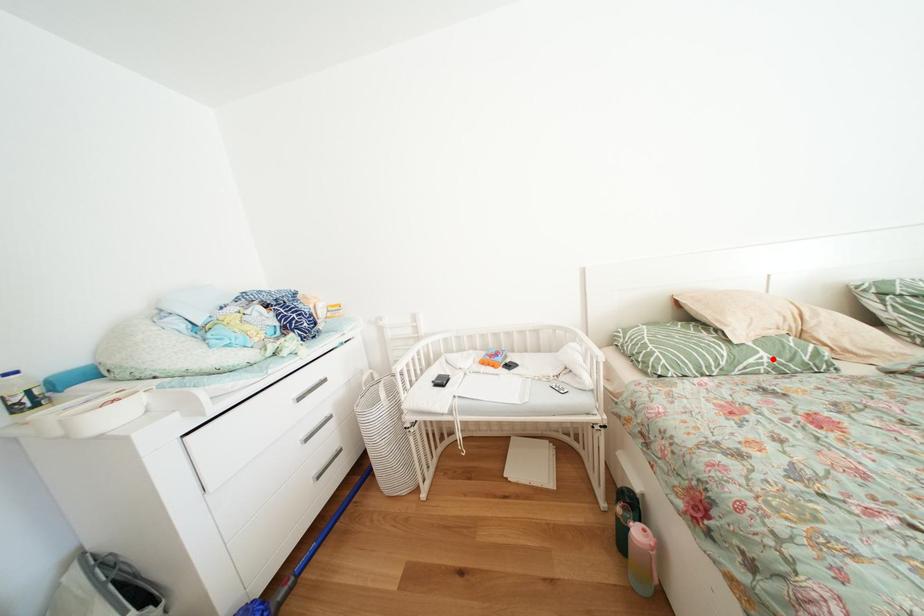
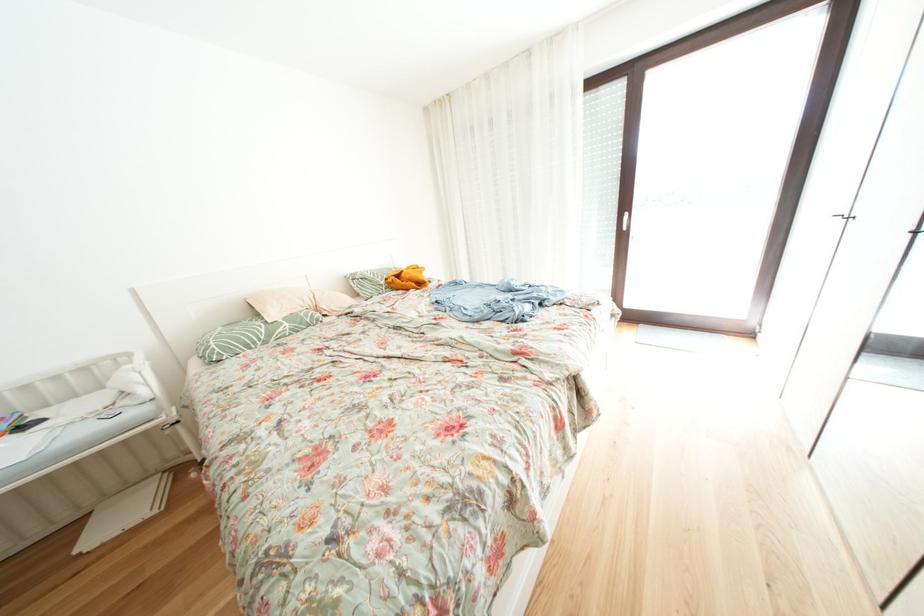
Locate, in the second image, the point that corresponds to the highlighted location in the first image.

(296, 329)